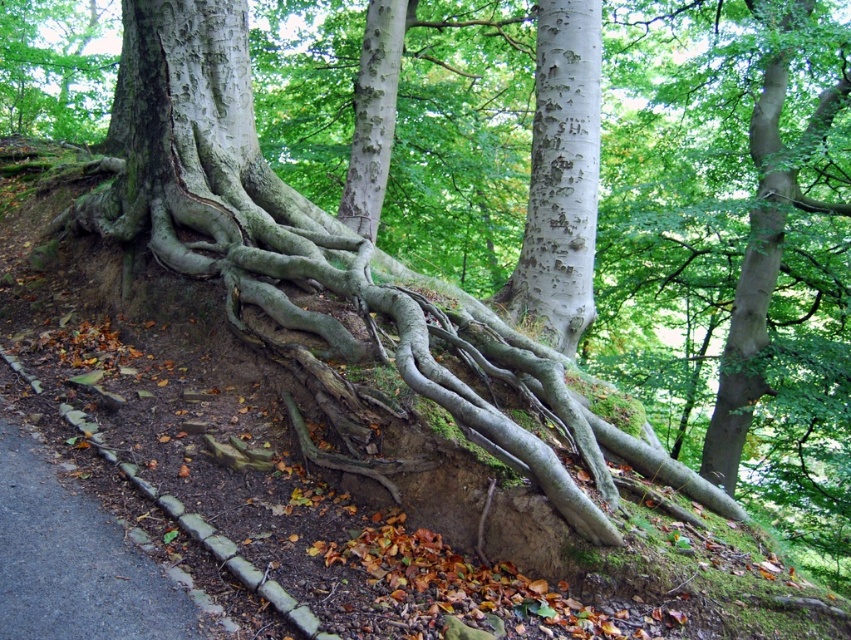
You are a botanist studying the tree in the image. You notice the smooth gray roots at upper left and the smooth white bark at center. Which of these two features is located to the left of the other?

The smooth gray roots at upper left are positioned to the left of the smooth white bark at center.

Based on the photo, you are a botanist examining the tree roots. You notice the white speckled bark at center and the smooth gray roots at upper left. Based on their positions, which object is located to the left of the other?

The smooth gray roots at upper left are to the left of the white speckled bark at center.